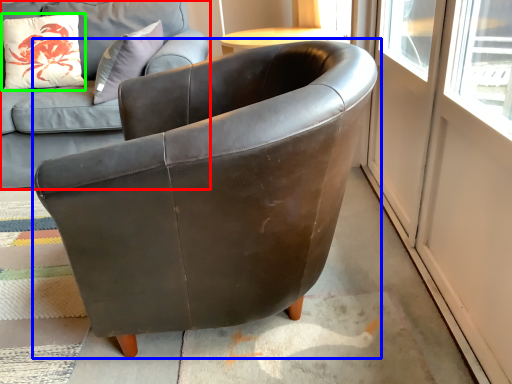
Question: Estimate the real-world distances between objects in this image. Which object is farther from studio couch (highlighted by a red box), chair (highlighted by a blue box) or pillow (highlighted by a green box)?

Choices:
 (A) chair
 (B) pillow

Answer: (A)